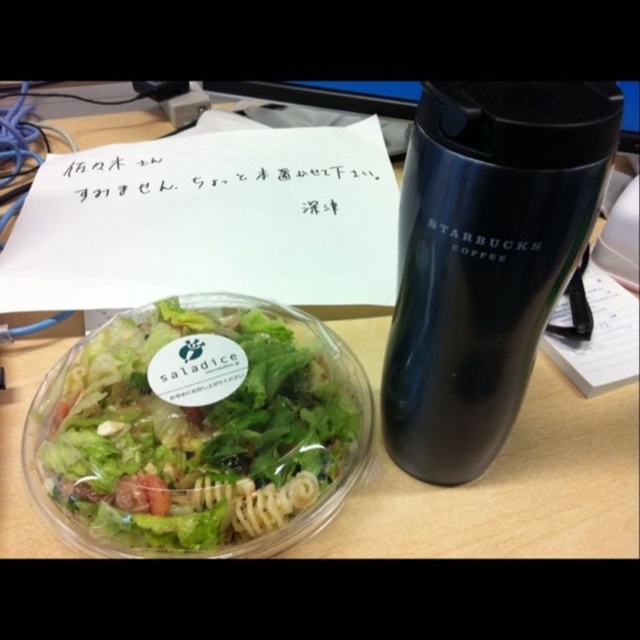
You have a small toy car that is 3 inches long. You want to place it between the wooden table at center and the black matte starbucks coffee cup at right. Will it fit without touching either object?

The wooden table at center and black matte starbucks coffee cup at right are 9.36 inches apart. Since the toy car is only 3 inches long, there is enough space between them to place the car without touching either object.

You are organizing a desk space and need to place a new item between the wooden table at center and the black matte starbucks coffee cup at right. Where should you place it?

The wooden table at center is to the left of the black matte starbucks coffee cup at right, so you should place the new item between them by positioning it to the right of the wooden table at center and to the left of the black matte starbucks coffee cup at right.